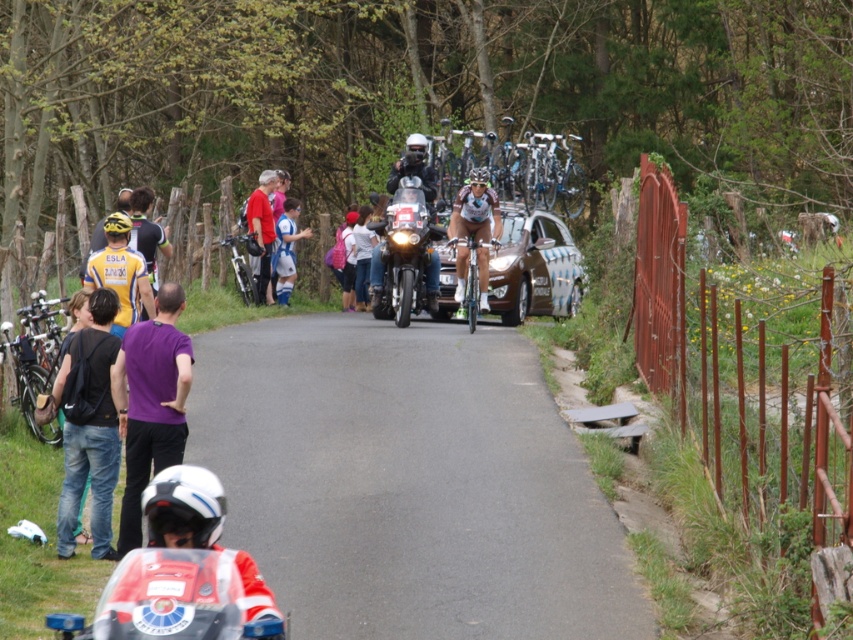
You are a photographer positioned at the back of the crowd. You want to take a photo of the blue jersey at center without the rusty metal fence at right appearing in the background. Is the fence too tall to block the view?

The rusty metal fence at right is taller than the blue jersey at center, so it will block the view of the blue jersey at center if positioned behind it.

You are a cyclist participating in a race and you want to position your bike between the rusty metal fence at right and the shiny black motorcycle at center. Is this possible given their positions?

The rusty metal fence at right is to the right of the shiny black motorcycle at center, so there is space between them. Positioning your bike between them is possible.